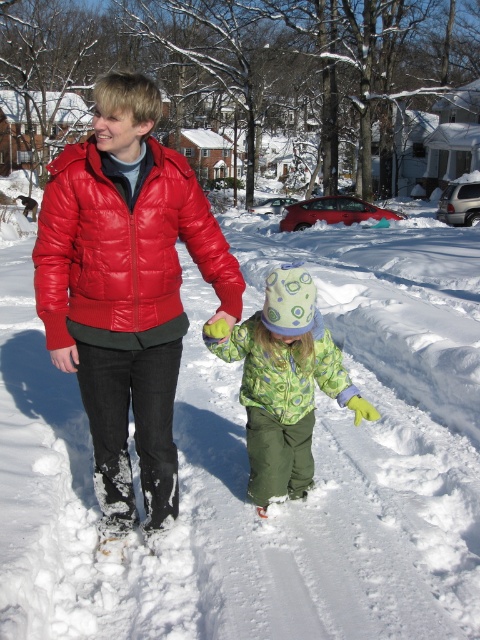
In the scene shown: You are a photographer trying to capture a photo of the shiny red puffer jacket at left and the green fuzzy coat at center. Which one is closer to the camera based on their positions?

The shiny red puffer jacket at left is positioned over the green fuzzy coat at center, meaning it is closer to the camera.

You are a photographer trying to capture a photo of both the shiny red puffer jacket at left and the green textured jacket at center. Since you want both subjects in the frame, which direction should you move to ensure both are visible?

You should move to the right to ensure both the shiny red puffer jacket at left and the green textured jacket at center are visible in the frame, as the shiny red puffer jacket at left is positioned to the left of the green textured jacket at center.

You are planning to build a snowman using the white fluffy snow at center and the green fuzzy coat at center. Which object would be more suitable for the snowman base?

The white fluffy snow at center is more suitable for the snowman base because it has a larger size compared to the green fuzzy coat at center.